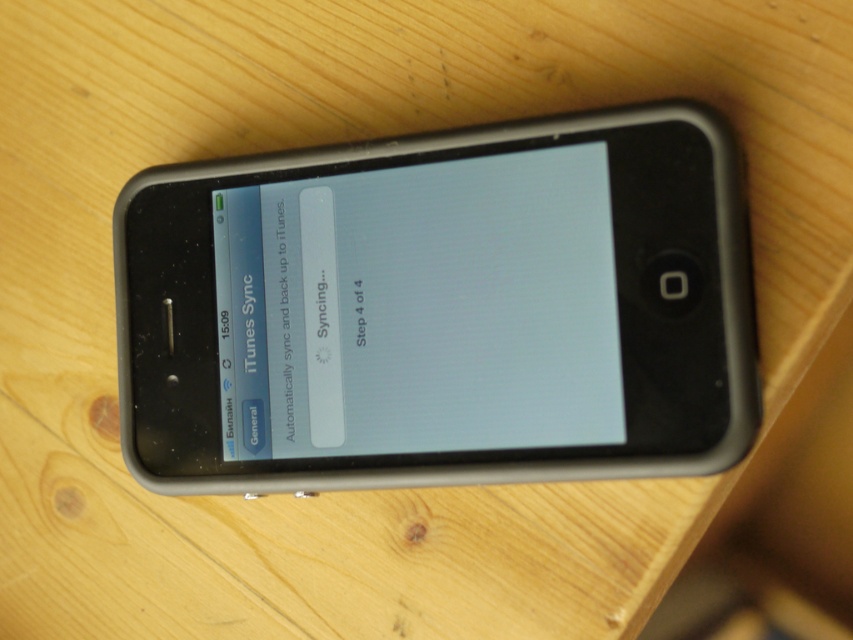
Question: Is matte black screen at center smaller than white matte text message at upper left?

Choices:
 (A) no
 (B) yes

Answer: (A)

Question: Is matte black screen at center closer to camera compared to white matte text message at upper left?

Choices:
 (A) yes
 (B) no

Answer: (A)

Question: Does matte black screen at center appear on the left side of white matte text message at upper left?

Choices:
 (A) no
 (B) yes

Answer: (A)

Question: Which point is farther to the camera?

Choices:
 (A) matte black screen at center
 (B) white matte text message at upper left

Answer: (B)

Question: Among these points, which one is farthest from the camera?

Choices:
 (A) (287, 348)
 (B) (328, 304)

Answer: (A)